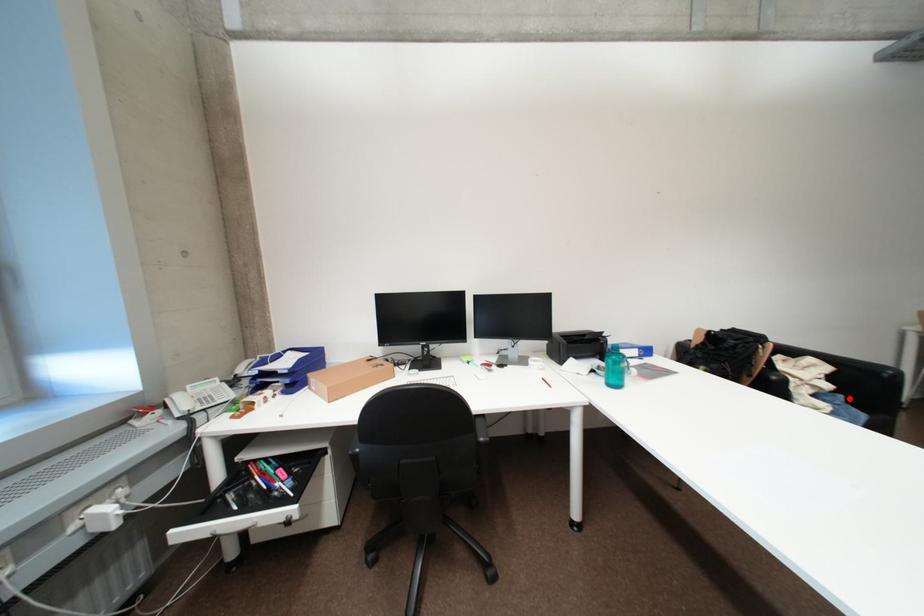
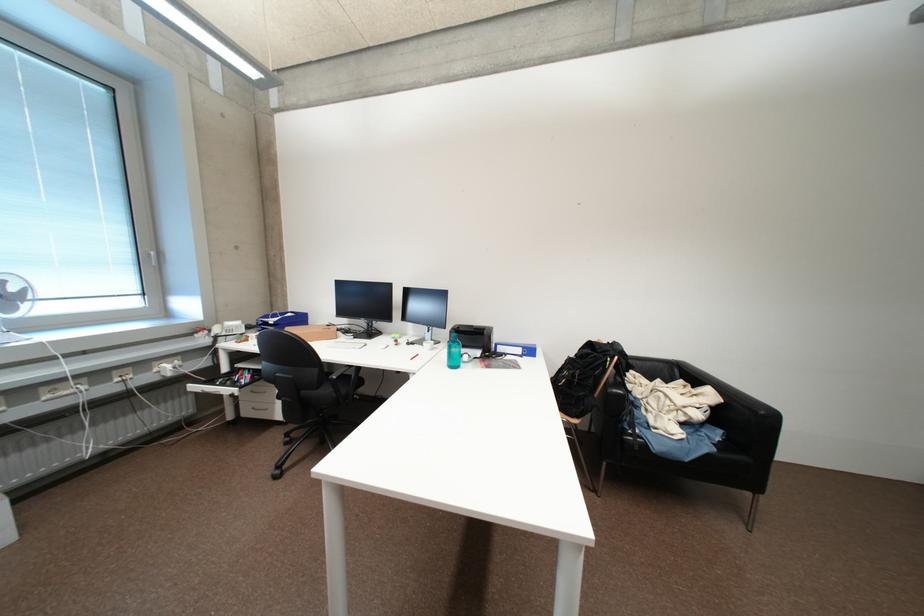
Where in the second image is the point corresponding to the highlighted location from the first image?

(727, 434)